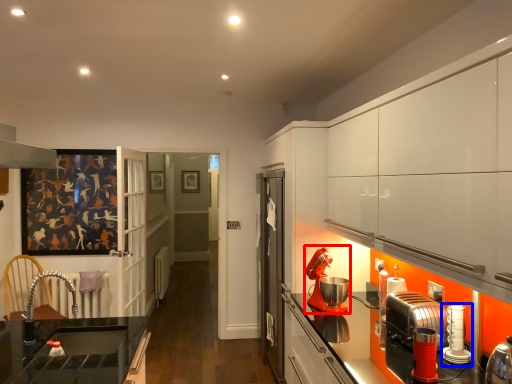
Question: Which object appears closest to the camera in this image, kitchen appliance (highlighted by a red box) or kitchen appliance (highlighted by a blue box)?

Choices:
 (A) kitchen appliance
 (B) kitchen appliance

Answer: (B)